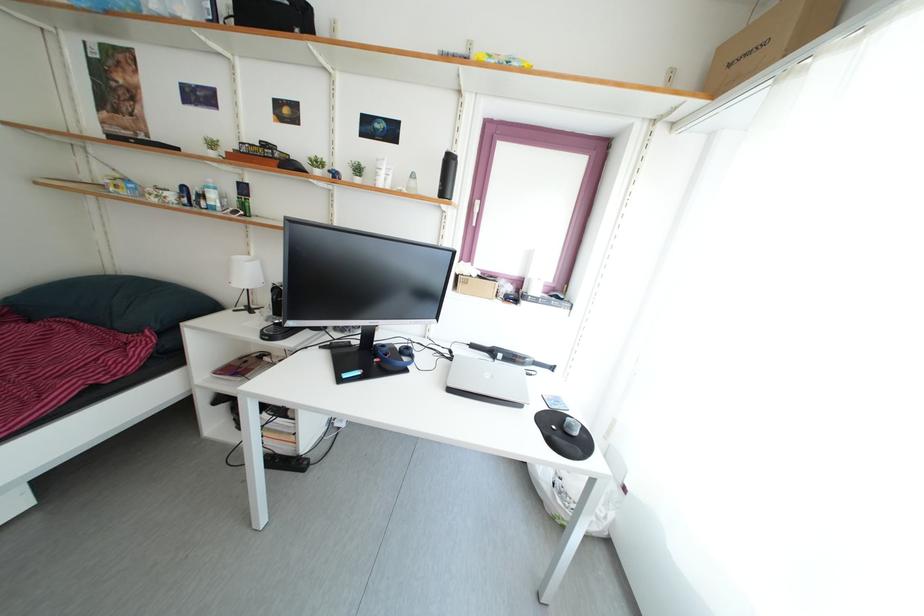
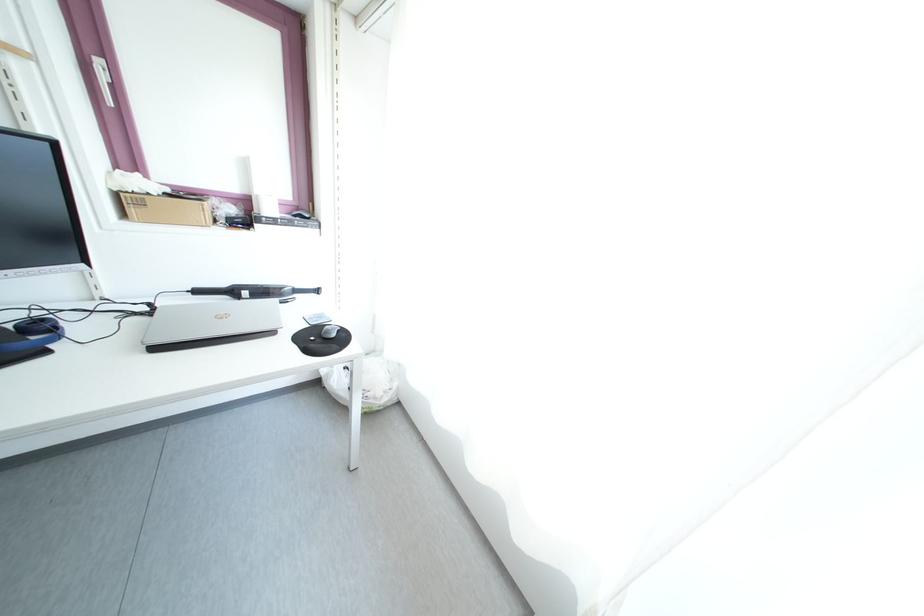
Where in the second image is the point corresponding to point 483,211 from the first image?

(105, 71)